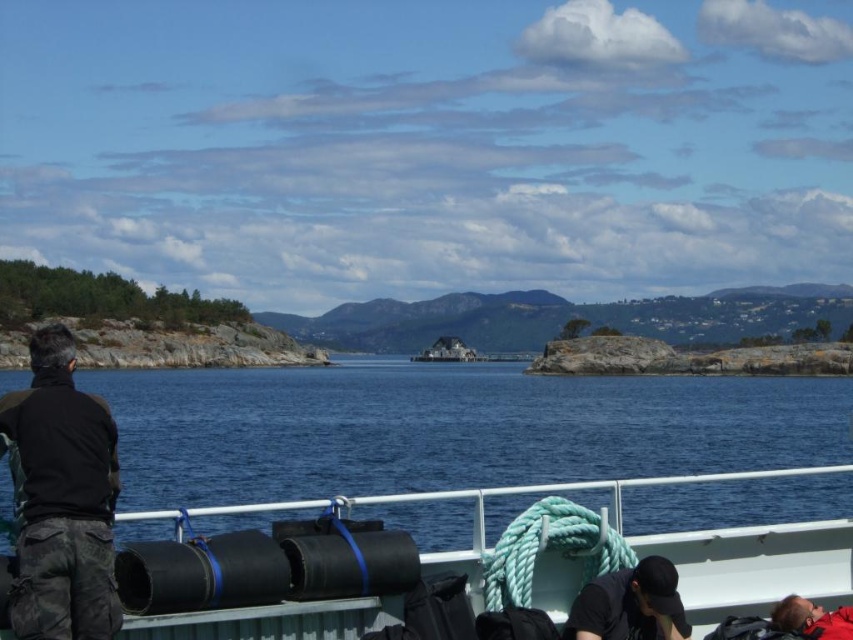
Question: Is blue water at center to the right of red fabric diver at lower right from the viewer's perspective?

Choices:
 (A) yes
 (B) no

Answer: (B)

Question: Which of these objects is positioned closest to the rubberized black tubes at center?

Choices:
 (A) black matte jacket at left
 (B) black matte diver at lower center

Answer: (B)

Question: Based on their relative distances, which object is farther from the black matte diver at lower center?

Choices:
 (A) black matte jacket at left
 (B) blue water at center
 (C) red fabric diver at lower right
 (D) rubberized black tubes at center

Answer: (B)

Question: Where is blue water at center located in relation to rubberized black tubes at center in the image?

Choices:
 (A) left
 (B) right

Answer: (B)

Question: Which point is closer to the camera taking this photo?

Choices:
 (A) (479, 572)
 (B) (82, 529)

Answer: (B)

Question: In this image, where is rubberized black tubes at center located relative to red fabric diver at lower right?

Choices:
 (A) below
 (B) above

Answer: (A)